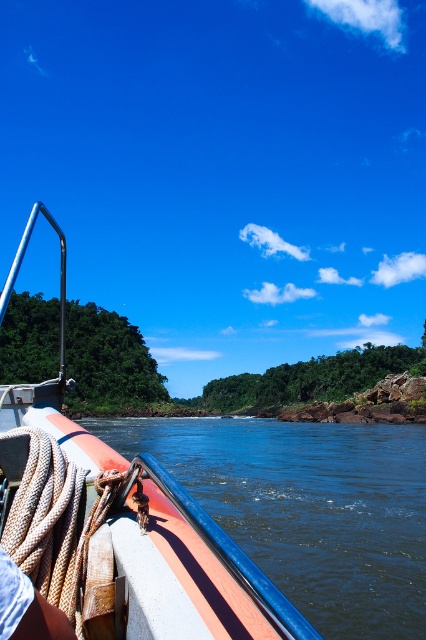
I want to click on orange rubber boat at left, so click(x=118, y=525).

Between point (121, 515) and point (397, 500), which one is positioned behind?

Point (397, 500)

Is point (137, 579) positioned before point (296, 502)?

That is True.

Locate an element on the screen. orange rubber boat at left is located at coordinates (118, 525).